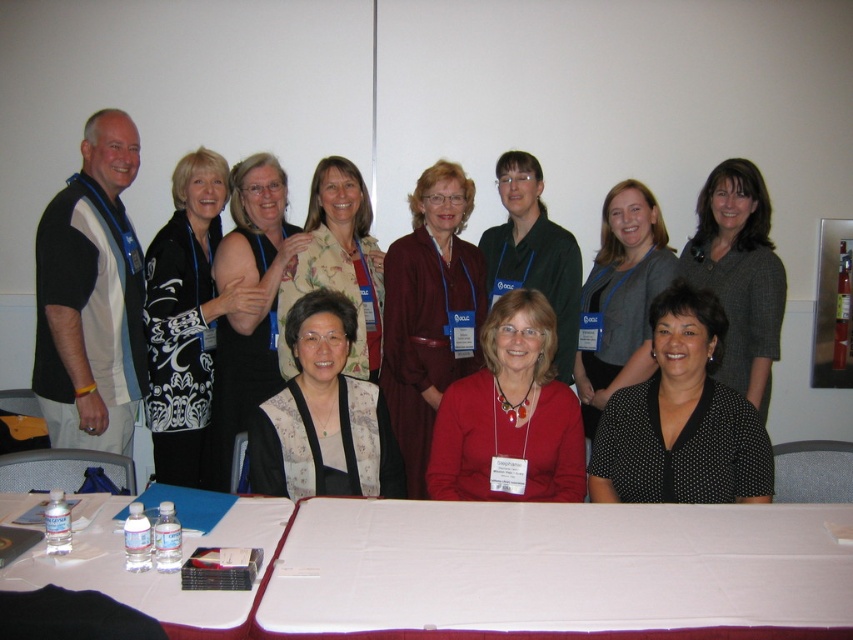
The height and width of the screenshot is (640, 853). In order to click on matte red sweater at center in this screenshot , I will do `click(509, 413)`.

Who is more distant from viewer, (527, 358) or (149, 355)?

The point (149, 355) is behind.

Identify the location of matte red sweater at center. [509, 413].

Who is higher up, white fabric tablecloth at lower center or matte red sweater at center?

matte red sweater at center

Which is more to the left, white fabric tablecloth at lower center or matte red sweater at center?

Positioned to the left is matte red sweater at center.

Does point (807, 620) come behind point (450, 497)?

No, it is in front of (450, 497).

The height and width of the screenshot is (640, 853). What are the coordinates of `white fabric tablecloth at lower center` in the screenshot? It's located at 556,570.

Between point (619, 346) and point (347, 180), which one is positioned in front?

Point (347, 180) is in front.

Can you confirm if black dotted dress at lower right is positioned below floral silk blouse at center?

Yes, black dotted dress at lower right is below floral silk blouse at center.

At what (x,y) coordinates should I click in order to perform the action: click on black dotted dress at lower right. Please return your answer as a coordinate pair (x, y). This screenshot has width=853, height=640. Looking at the image, I should click on (621, 298).